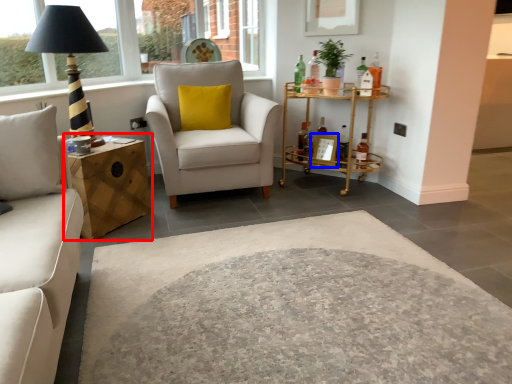
Question: Which object is further to the camera taking this photo, nightstand (highlighted by a red box) or picture frame (highlighted by a blue box)?

Choices:
 (A) nightstand
 (B) picture frame

Answer: (B)